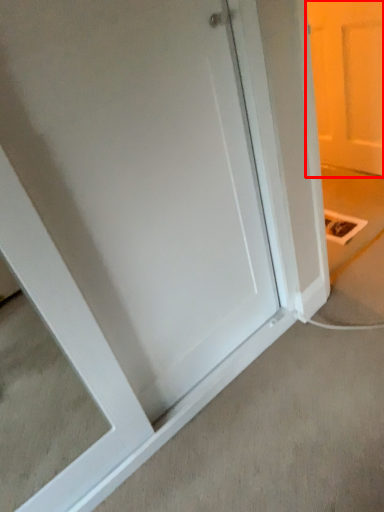
Question: From the image's perspective, what is the correct spatial positioning of door (annotated by the red box) in reference to concrete?

Choices:
 (A) above
 (B) below

Answer: (A)